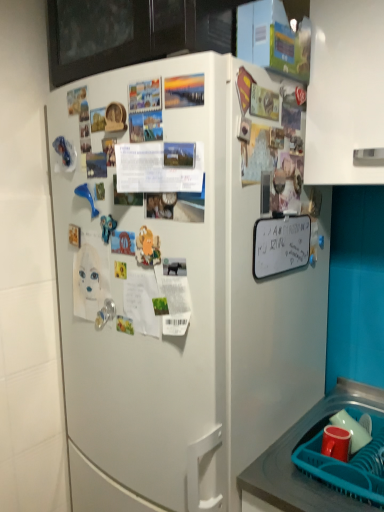
What do you see at coordinates (182, 287) in the screenshot?
I see `white matte refrigerator at center` at bounding box center [182, 287].

Find the location of a particular element. white matte dry erase board at upper right, which is the 1th poster from bottom to top is located at coordinates (280, 244).

You are a GUI agent. You are given a task and a screenshot of the screen. Output one action in this format:
    pyautogui.click(x=<x>, y=<y>)
    Task: Click on the teal plastic basket at lower right
    This screenshot has width=384, height=512.
    Given the screenshot: What is the action you would take?
    pyautogui.click(x=347, y=467)

I want to click on white matte refrigerator at center, so click(x=182, y=287).

The image size is (384, 512). There is a white matte refrigerator at center. Find the location of `the 3rd poster above it (from the image's perspective)`. the 3rd poster above it (from the image's perspective) is located at coordinates (184, 91).

From the image's perspective, does white matte refrigerator at center appear lower than matte paper poster at upper center, which ranks as the 3th poster in bottom-to-top order?

Correct, white matte refrigerator at center appears lower than matte paper poster at upper center, which ranks as the 3th poster in bottom-to-top order, in the image.

Does point (147, 376) lie behind point (196, 79)?

Yes, it is.

Which object is closer to the camera taking this photo, white matte refrigerator at center or matte paper poster at upper center, acting as the second poster starting from the right?

Positioned in front is white matte refrigerator at center.

Based on the photo, is white matte dry erase board at upper right, positioned as the 3th poster in left-to-right order, outside of smooth plastic tray at lower right?

Absolutely, white matte dry erase board at upper right, positioned as the 3th poster in left-to-right order, is external to smooth plastic tray at lower right.

Who is taller, white matte dry erase board at upper right, positioned as the 3th poster in left-to-right order, or smooth plastic tray at lower right?

smooth plastic tray at lower right.

Is white matte dry erase board at upper right, positioned as the 3th poster in left-to-right order, in front of smooth plastic tray at lower right?

No, it is behind smooth plastic tray at lower right.

Does white matte dry erase board at upper right, positioned as the 3th poster in left-to-right order, have a larger size compared to smooth plastic tray at lower right?

No, white matte dry erase board at upper right, positioned as the 3th poster in left-to-right order, is not bigger than smooth plastic tray at lower right.

Considering the relative sizes of white matte dry erase board at upper right, which is the 1th poster from bottom to top, and white matte refrigerator at center in the image provided, is white matte dry erase board at upper right, which is the 1th poster from bottom to top, wider than white matte refrigerator at center?

No.

Which point is more forward, (310, 242) or (133, 297)?

The point (133, 297) is more forward.

Is white matte dry erase board at upper right, positioned as the 3th poster in left-to-right order, directly adjacent to white matte refrigerator at center?

No, white matte dry erase board at upper right, positioned as the 3th poster in left-to-right order, is not in contact with white matte refrigerator at center.

How many degrees apart are the facing directions of white matte dry erase board at upper right, placed as the third poster when sorted from front to back, and white matte refrigerator at center?

The angular difference between white matte dry erase board at upper right, placed as the third poster when sorted from front to back, and white matte refrigerator at center is 90 degrees.

Does white matte refrigerator at center have a lesser width compared to white matte dry erase board at upper right, which is the 1th poster from bottom to top?

Incorrect, the width of white matte refrigerator at center is not less than that of white matte dry erase board at upper right, which is the 1th poster from bottom to top.

In the scene shown: Considering the positions of objects white matte refrigerator at center and white matte dry erase board at upper right, which is the 1th poster from bottom to top, in the image provided, who is behind, white matte refrigerator at center or white matte dry erase board at upper right, which is the 1th poster from bottom to top,?

white matte dry erase board at upper right, which is the 1th poster from bottom to top, is more distant.

Are white matte refrigerator at center and white matte dry erase board at upper right, which is the 1th poster from bottom to top, far apart?

white matte refrigerator at center is actually quite close to white matte dry erase board at upper right, which is the 1th poster from bottom to top.

Is white matte refrigerator at center shorter than white matte dry erase board at upper right, which is counted as the 1th poster, starting from the right?

No.

Which point is more forward, [313,409] or [289,259]?

The point [289,259] is in front.

From a real-world perspective, is smooth plastic tray at lower right physically above white matte dry erase board at upper right, placed as the third poster when sorted from front to back?

No, from a real-world perspective, smooth plastic tray at lower right is not above white matte dry erase board at upper right, placed as the third poster when sorted from front to back.

Is smooth plastic tray at lower right to the left of white matte dry erase board at upper right, which is the 1th poster from bottom to top, from the viewer's perspective?

No.

Can we say smooth plastic tray at lower right lies outside white matte dry erase board at upper right, the first poster viewed from the back?

smooth plastic tray at lower right lies outside white matte dry erase board at upper right, the first poster viewed from the back,'s area.

Does teal plastic basket at lower right have a greater height compared to white matte refrigerator at center?

No, teal plastic basket at lower right is not taller than white matte refrigerator at center.

Is teal plastic basket at lower right next to white matte refrigerator at center?

No, teal plastic basket at lower right is not touching white matte refrigerator at center.

Does teal plastic basket at lower right turn towards white matte refrigerator at center?

No, teal plastic basket at lower right does not turn towards white matte refrigerator at center.

From the picture: Which of these two, teal plastic basket at lower right or white matte refrigerator at center, is wider?

white matte refrigerator at center is wider.

In terms of size, does matte paper poster at upper center, acting as the second poster starting from the right, appear bigger or smaller than white matte dry erase board at upper right, the first poster viewed from the back?

matte paper poster at upper center, acting as the second poster starting from the right, is smaller than white matte dry erase board at upper right, the first poster viewed from the back.

Considering the sizes of objects matte paper poster at upper center, the second poster from the left, and white matte dry erase board at upper right, the first poster viewed from the back, in the image provided, who is thinner, matte paper poster at upper center, the second poster from the left, or white matte dry erase board at upper right, the first poster viewed from the back,?

Thinner between the two is matte paper poster at upper center, the second poster from the left.

Can you see matte paper poster at upper center, which is the second poster from front to back, touching white matte dry erase board at upper right, positioned as the 3th poster in left-to-right order?

matte paper poster at upper center, which is the second poster from front to back, is not next to white matte dry erase board at upper right, positioned as the 3th poster in left-to-right order, and they're not touching.

What are the coordinates of `the 2nd poster behind the white matte refrigerator at center, counting from the anchor's position` in the screenshot? It's located at (184, 91).

Locate an element on the screen. counter top below the white matte dry erase board at upper right, the third poster positioned from the top (from the image's perspective) is located at coordinates pyautogui.click(x=294, y=465).

Estimate the real-world distances between objects in this image. Which object is further from matte paper poster at upper center, which is the second poster from front to back, white matte dry erase board at upper right, which is counted as the 1th poster, starting from the right, or white paper at center, which is counted as the 3th poster, starting from the right?

Based on the image, white matte dry erase board at upper right, which is counted as the 1th poster, starting from the right, appears to be further to matte paper poster at upper center, which is the second poster from front to back.

When comparing their distances from white paper at center, placed as the 2th poster when sorted from bottom to top, does matte red cup at lower right or smooth plastic tray at lower right seem closer?

smooth plastic tray at lower right is positioned closer to the anchor white paper at center, placed as the 2th poster when sorted from bottom to top.

Looking at the image, which one is located closer to teal plastic basket at lower right, smooth plastic tray at lower right or white matte dry erase board at upper right, placed as the third poster when sorted from front to back?

smooth plastic tray at lower right is positioned closer to the anchor teal plastic basket at lower right.

Looking at the image, which one is located further to white matte dry erase board at upper right, positioned as the 3th poster in left-to-right order, matte paper poster at upper center, the second poster from the left, or smooth plastic tray at lower right?

Based on the image, smooth plastic tray at lower right appears to be further to white matte dry erase board at upper right, positioned as the 3th poster in left-to-right order.

When comparing their distances from white matte dry erase board at upper right, which is counted as the 1th poster, starting from the right, does white matte refrigerator at center or smooth plastic tray at lower right seem further?

Among the two, smooth plastic tray at lower right is located further to white matte dry erase board at upper right, which is counted as the 1th poster, starting from the right.

From the image, which object appears to be nearer to white matte dry erase board at upper right, which is the 1th poster from bottom to top, matte paper poster at upper center, marked as the first poster in a top-to-bottom arrangement, or white paper at center, marked as the 1th poster in a front-to-back arrangement?

white paper at center, marked as the 1th poster in a front-to-back arrangement, is closer to white matte dry erase board at upper right, which is the 1th poster from bottom to top.

From the image, which object appears to be farther from white paper at center, marked as the third poster in a back-to-front arrangement, smooth plastic tray at lower right or teal plastic basket at lower right?

smooth plastic tray at lower right is further to white paper at center, marked as the third poster in a back-to-front arrangement.

When comparing their distances from white matte refrigerator at center, does teal plastic basket at lower right or matte paper poster at upper center, the second poster from the left, seem closer?

matte paper poster at upper center, the second poster from the left, lies closer to white matte refrigerator at center than the other object.

At what (x,y) coordinates should I click in order to perform the action: click on refrigerator that lies between white matte dry erase board at upper right, the third poster positioned from the top, and teal plastic basket at lower right from top to bottom. Please return your answer as a coordinate pair (x, y). The width and height of the screenshot is (384, 512). Looking at the image, I should click on (182, 287).

You are a GUI agent. You are given a task and a screenshot of the screen. Output one action in this format:
    pyautogui.click(x=<x>, y=<y>)
    Task: Click on the coffee cup that lies between white paper at center, marked as the 1th poster in a front-to-back arrangement, and smooth plastic tray at lower right from top to bottom
    
    Given the screenshot: What is the action you would take?
    pyautogui.click(x=336, y=443)

Where is `refrigerator between matte paper poster at upper center, which is the second poster from front to back, and smooth plastic tray at lower right, in the vertical direction`? This screenshot has height=512, width=384. refrigerator between matte paper poster at upper center, which is the second poster from front to back, and smooth plastic tray at lower right, in the vertical direction is located at coordinates (182, 287).

Find the location of `poster between white paper at center, marked as the third poster in a back-to-front arrangement, and white matte refrigerator at center vertically`. poster between white paper at center, marked as the third poster in a back-to-front arrangement, and white matte refrigerator at center vertically is located at coordinates pyautogui.click(x=280, y=244).